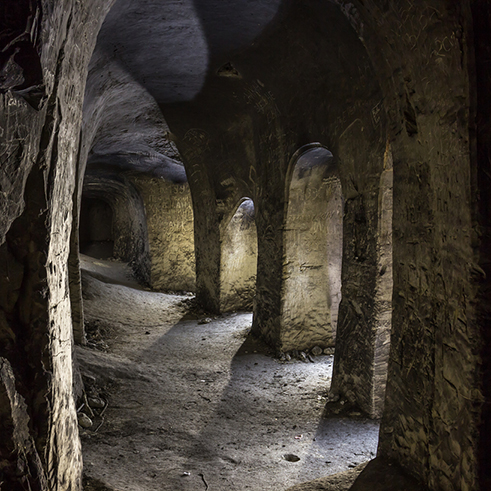
Locate an element on the screen. The width and height of the screenshot is (491, 491). light shining on floor through arches on right is located at coordinates (246, 321), (173, 300), (319, 372), (299, 447).